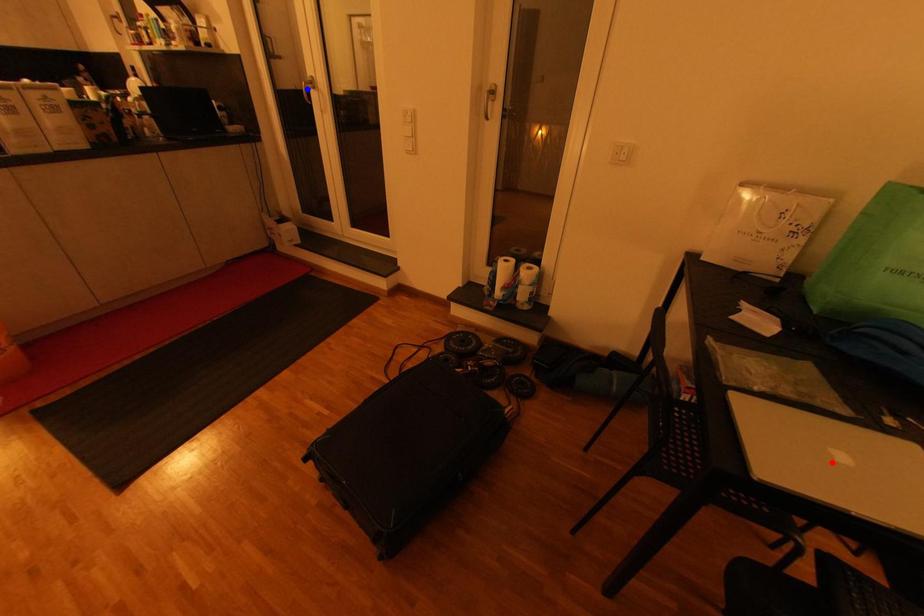
Question: Which of the two points in the image is closer to the camera?

Choices:
 (A) Blue point is closer.
 (B) Red point is closer.

Answer: (B)